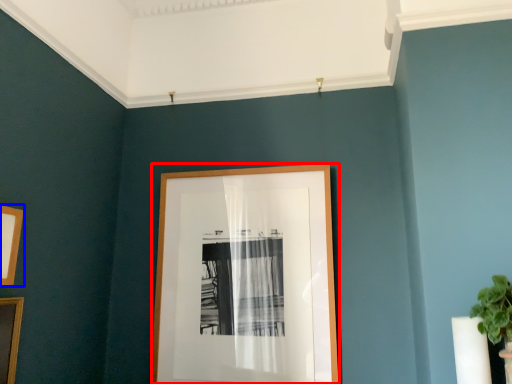
Question: Which object appears farthest to the camera in this image, picture frame (highlighted by a red box) or picture frame (highlighted by a blue box)?

Choices:
 (A) picture frame
 (B) picture frame

Answer: (A)